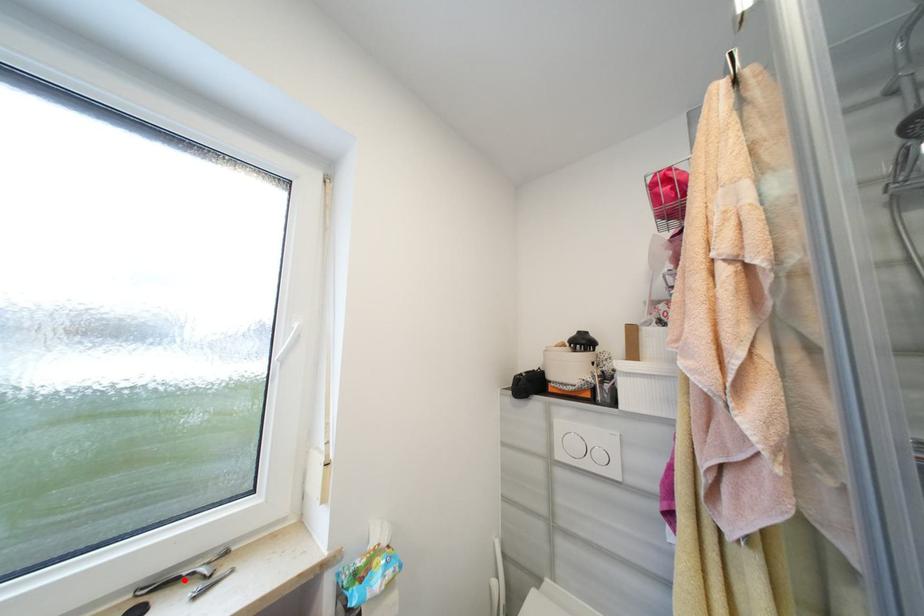
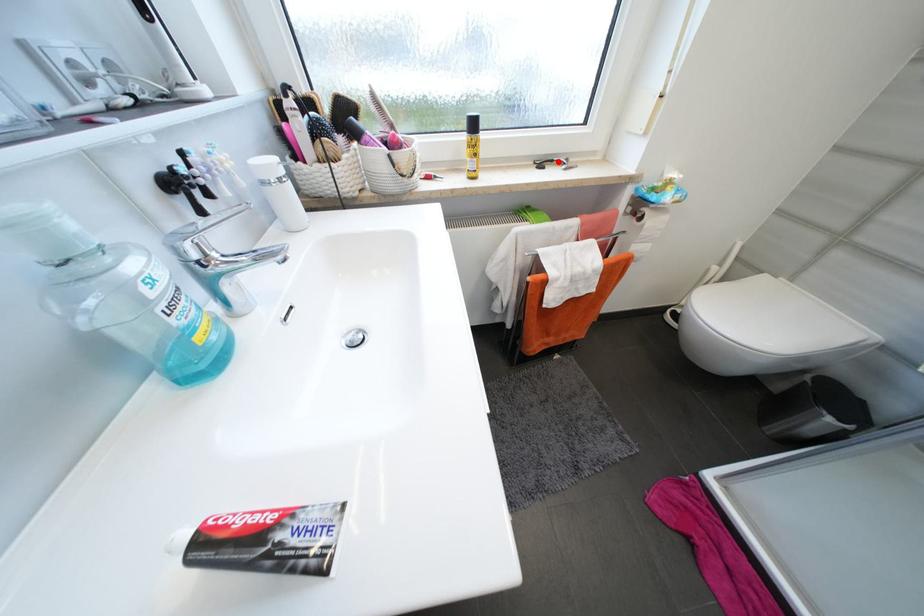
I am providing you with two images of the same scene from different viewpoints. A red point is marked on the first image and another point is marked on the second image. Do the highlighted points in image1 and image2 indicate the same real-world spot?

Yes